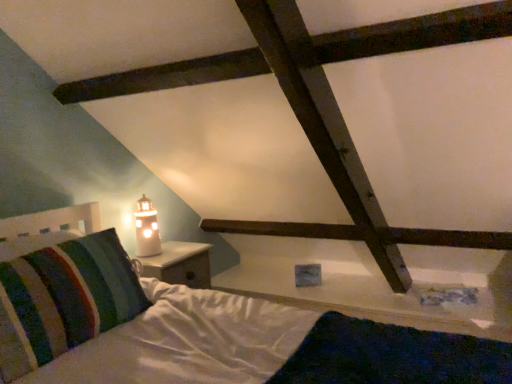
Question: Is matte glass lighthouse at left positioned in front of striped fabric pillow at left?

Choices:
 (A) no
 (B) yes

Answer: (A)

Question: Would you say matte glass lighthouse at left is a long distance from striped fabric pillow at left?

Choices:
 (A) no
 (B) yes

Answer: (A)

Question: Could you tell me if matte glass lighthouse at left is turned towards striped fabric pillow at left?

Choices:
 (A) no
 (B) yes

Answer: (A)

Question: Is matte glass lighthouse at left located outside striped fabric pillow at left?

Choices:
 (A) no
 (B) yes

Answer: (B)

Question: Can you confirm if matte glass lighthouse at left is wider than striped fabric pillow at left?

Choices:
 (A) no
 (B) yes

Answer: (A)

Question: From the image's perspective, is matte glass lighthouse at left below striped fabric pillow at left?

Choices:
 (A) no
 (B) yes

Answer: (A)

Question: From the image's perspective, is striped fabric pillow at left below matte glass lighthouse at left?

Choices:
 (A) no
 (B) yes

Answer: (B)

Question: Does striped fabric pillow at left lie behind matte glass lighthouse at left?

Choices:
 (A) no
 (B) yes

Answer: (A)

Question: From a real-world perspective, is striped fabric pillow at left over matte glass lighthouse at left?

Choices:
 (A) no
 (B) yes

Answer: (A)

Question: Could matte glass lighthouse at left be considered to be inside striped fabric pillow at left?

Choices:
 (A) no
 (B) yes

Answer: (A)

Question: Considering the relative positions of striped fabric pillow at left and matte glass lighthouse at left in the image provided, is striped fabric pillow at left to the left of matte glass lighthouse at left from the viewer's perspective?

Choices:
 (A) yes
 (B) no

Answer: (A)

Question: Is striped fabric pillow at left thinner than matte glass lighthouse at left?

Choices:
 (A) yes
 (B) no

Answer: (B)

Question: From the image's perspective, is matte glass lighthouse at left positioned above or below striped fabric pillow at left?

Choices:
 (A) below
 (B) above

Answer: (B)